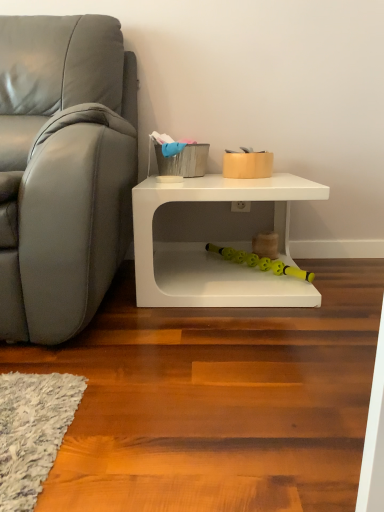
Question: Considering the positions of matte gray couch at left and white matte table at lower right in the image, is matte gray couch at left taller or shorter than white matte table at lower right?

Choices:
 (A) tall
 (B) short

Answer: (A)

Question: In terms of size, does matte gray couch at left appear bigger or smaller than white matte table at lower right?

Choices:
 (A) big
 (B) small

Answer: (A)

Question: Estimate the real-world distances between objects in this image. Which object is closer to the matte gray couch at left?

Choices:
 (A) matte gold container at center, which is the 1th toy from top to bottom
 (B) yellow rubber toy at lower center, positioned as the 1th toy in bottom-to-top order
 (C) white matte table at lower right

Answer: (C)

Question: Which is farther from the yellow rubber toy at lower center, marked as the 2th toy in a top-to-bottom arrangement?

Choices:
 (A) matte gray couch at left
 (B) matte gold container at center, which is the 1th toy from top to bottom
 (C) white matte table at lower right

Answer: (A)